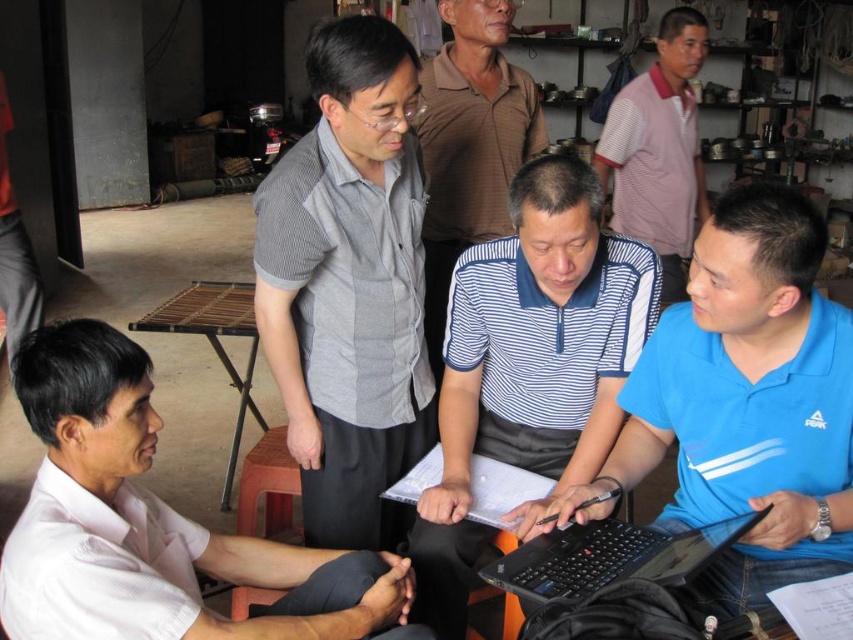
You are a photographer trying to capture a photo of the gray striped shirt at upper center and the black matte laptop at lower center. Which object should you focus on first if you want to ensure both are in focus without moving the camera?

The gray striped shirt at upper center is much taller than the black matte laptop at lower center, so you should focus on the gray striped shirt at upper center first to ensure both are in focus.

You are a person who needs to reach the black matte laptop at lower center from where you are standing near the gray striped shirt at upper center. The workspace has limited space. Can you comfortably reach the laptop without moving your position?

The distance between the gray striped shirt at upper center and the black matte laptop at lower center is 24.86 inches. Since this distance is within typical comfortable reaching range for most adults, you can likely reach the laptop without moving your position.